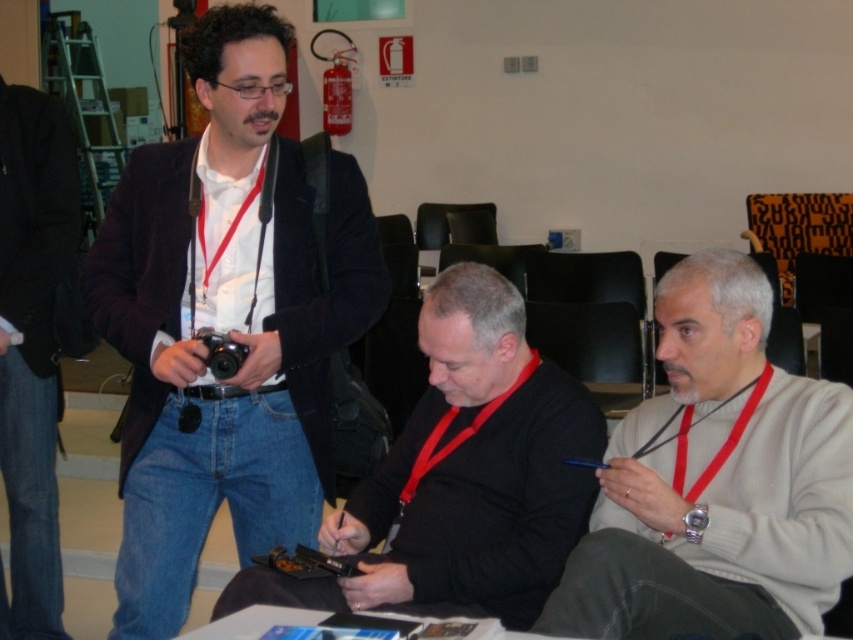
Between black matte sweater at center and black leather jacket at left, which one appears on the left side from the viewer's perspective?

black leather jacket at left is more to the left.

Between black matte sweater at center and black leather jacket at left, which one is positioned lower?

black matte sweater at center is lower down.

At what (x,y) coordinates should I click in order to perform the action: click on black matte sweater at center. Please return your answer as a coordinate pair (x, y). The image size is (853, 640). Looking at the image, I should click on (462, 476).

The image size is (853, 640). I want to click on black matte sweater at center, so click(x=462, y=476).

Does matte black jacket at left appear under black plastic camera at center?

Actually, matte black jacket at left is above black plastic camera at center.

Is matte black jacket at left positioned at the back of black plastic camera at center?

No, matte black jacket at left is in front of black plastic camera at center.

Who is more distant from viewer, (218, 250) or (209, 340)?

Positioned behind is point (218, 250).

I want to click on matte black jacket at left, so click(225, 323).

Between gray wool sweater at right and black plastic camera at center, which one is positioned lower?

Positioned lower is gray wool sweater at right.

Is gray wool sweater at right to the right of black plastic camera at center from the viewer's perspective?

Indeed, gray wool sweater at right is positioned on the right side of black plastic camera at center.

Identify the location of gray wool sweater at right. This screenshot has width=853, height=640. (717, 483).